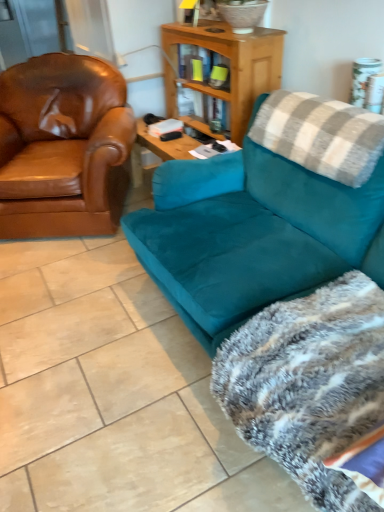
You are a GUI agent. You are given a task and a screenshot of the screen. Output one action in this format:
    pyautogui.click(x=<x>, y=<y>)
    Task: Click on the vacant space that is to the left of teal suede couch at right
    The width and height of the screenshot is (384, 512).
    Given the screenshot: What is the action you would take?
    pyautogui.click(x=89, y=361)